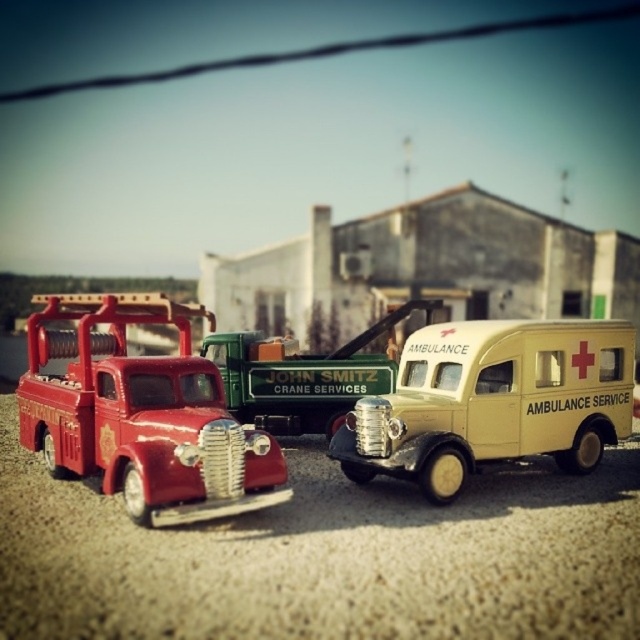
Question: Considering the relative positions of matte red truck at left and beige matte ambulance service vehicle at center in the image provided, where is matte red truck at left located with respect to beige matte ambulance service vehicle at center?

Choices:
 (A) left
 (B) right

Answer: (A)

Question: Which point appears closest to the camera in this image?

Choices:
 (A) (483, 435)
 (B) (321, 392)
 (C) (285, 563)
 (D) (200, 365)

Answer: (C)

Question: Which point appears farthest from the camera in this image?

Choices:
 (A) (584, 417)
 (B) (48, 387)
 (C) (296, 401)

Answer: (C)

Question: Is matte red truck at left in front of green matte truck at center?

Choices:
 (A) no
 (B) yes

Answer: (B)

Question: Can you confirm if matte red truck at left is wider than green matte truck at center?

Choices:
 (A) yes
 (B) no

Answer: (A)

Question: Estimate the real-world distances between objects in this image. Which object is farther from the smooth gravel at center?

Choices:
 (A) matte red truck at left
 (B) beige matte ambulance service vehicle at center

Answer: (B)